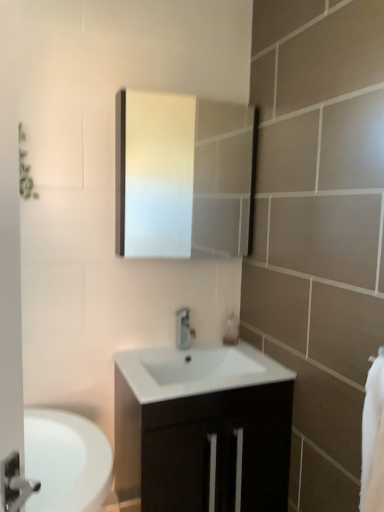
I want to click on vacant space situated on the left part of silver metallic faucet at center, so click(x=155, y=354).